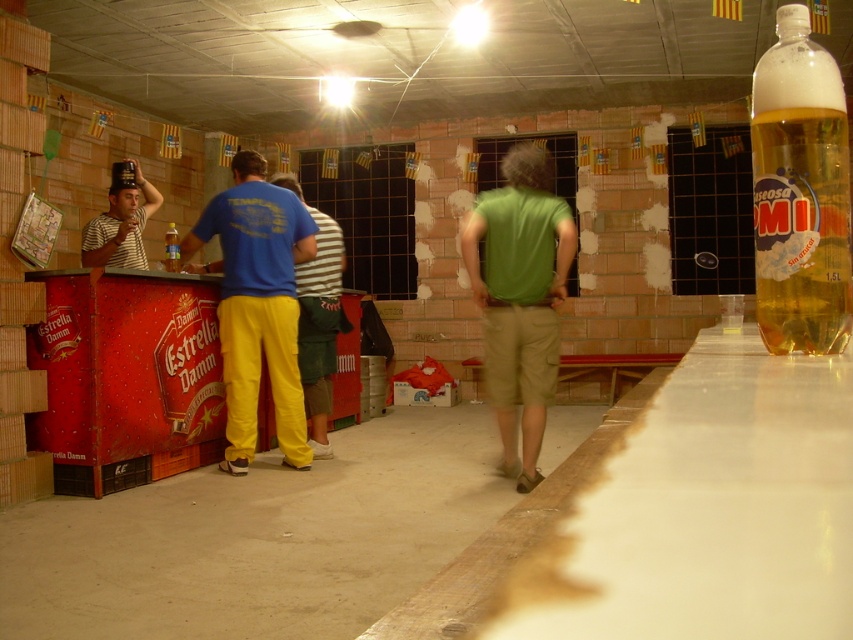
You are a delivery person who needs to place a new 1.5 liter Estrella Damm beer bottle on the counter. The existing bottle is at point (799, 193). Where should you place the new bottle to avoid overlapping with the existing one?

Place the new bottle away from point (799, 193) to avoid overlapping with the translucent plastic bottle of beer at upper right.

You are a customer at the bar and want to grab the translucent plastic bottle of beer at upper right. The bartender tells you that the bottle is placed at coordinates point 0.302, 0.938. If you start moving from the center of the counter, which direction should you move to reach the bottle?

The translucent plastic bottle of beer at upper right is located at point (x=799, y=193), so you should move towards the upper right direction from the center of the counter to reach it.